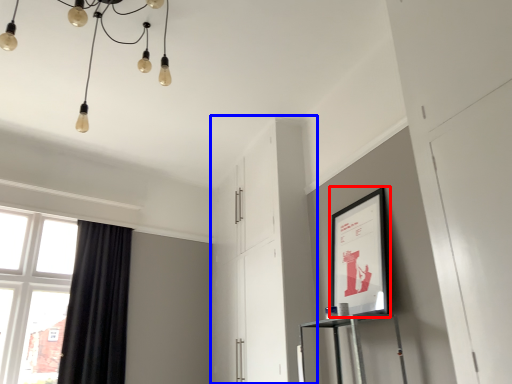
Question: Among these objects, which one is farthest to the camera, picture frame (highlighted by a red box) or dresser (highlighted by a blue box)?

Choices:
 (A) picture frame
 (B) dresser

Answer: (B)